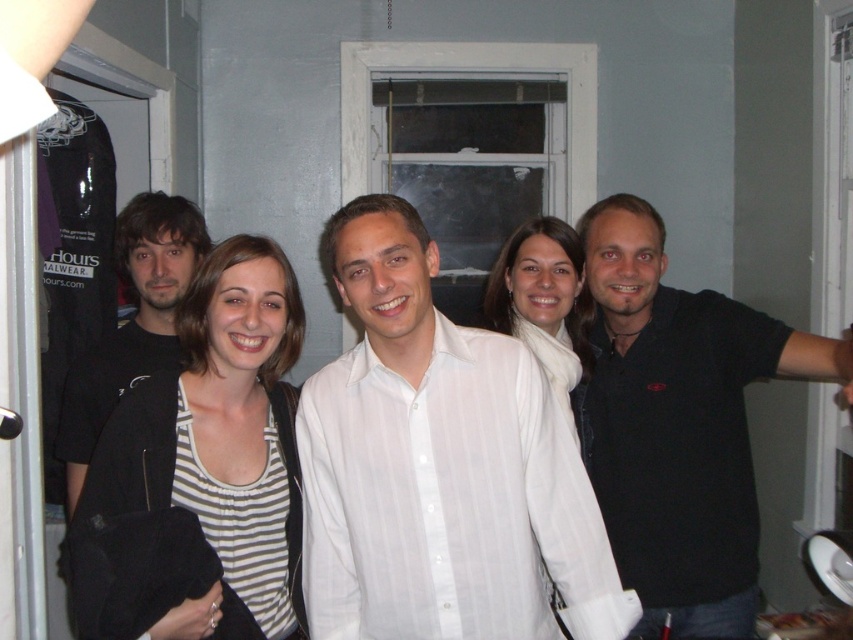
Between black matte shirt at right and black matte jacket at left, which one appears on the right side from the viewer's perspective?

From the viewer's perspective, black matte shirt at right appears more on the right side.

Who is shorter, black matte shirt at right or black matte jacket at left?

black matte jacket at left

The height and width of the screenshot is (640, 853). What do you see at coordinates (677, 422) in the screenshot? I see `black matte shirt at right` at bounding box center [677, 422].

I want to click on black matte shirt at right, so click(677, 422).

Between white striped shirt at center and black matte jacket at left, which one has more height?

Standing taller between the two is black matte jacket at left.

Can you confirm if white striped shirt at center is bigger than black matte jacket at left?

Yes.

Which is in front, point (525, 616) or point (100, 419)?

Point (525, 616)

Locate an element on the screen. white striped shirt at center is located at coordinates (439, 467).

Which is below, white striped shirt at center or striped fabric shirt at center?

striped fabric shirt at center is lower down.

Does white striped shirt at center appear on the left side of striped fabric shirt at center?

No, white striped shirt at center is not to the left of striped fabric shirt at center.

Who is more distant from viewer, (x=416, y=346) or (x=209, y=435)?

The point (x=209, y=435) is behind.

The width and height of the screenshot is (853, 640). I want to click on white striped shirt at center, so pos(439,467).